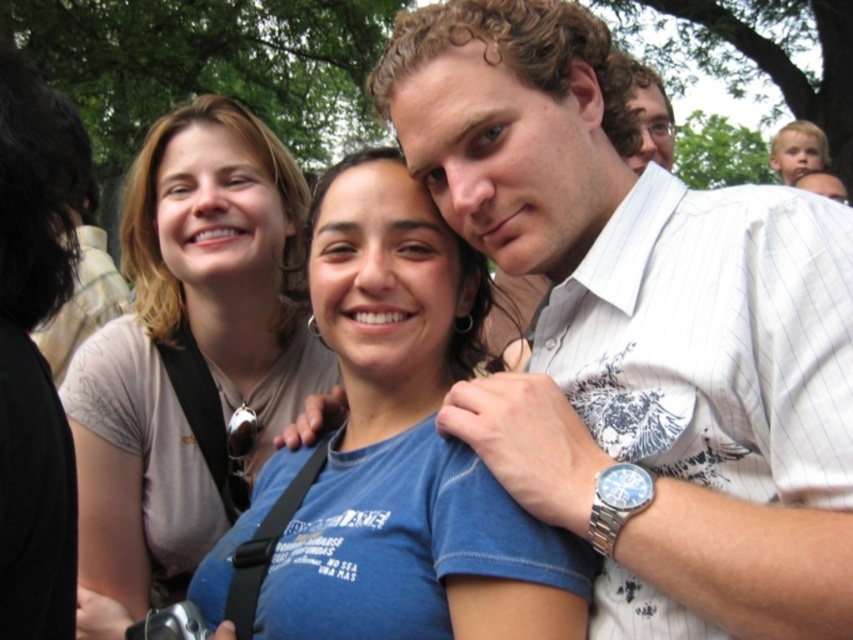
You are a photographer adjusting your camera settings to focus on the white pinstriped shirt at center and the matte black glasses at upper center. Which object should you focus on first to ensure both are in sharp focus?

The white pinstriped shirt at center should be focused on first because it is closer to the viewer than the matte black glasses at upper center. By focusing on the closer object, the farther one may still be in focus depending on the depth of field.

You are a photographer adjusting your camera settings. You notice the blue cotton shirt at center and the matte black glasses at upper center in your viewfinder. Which object should you focus on first if you want to capture both in sharp focus without moving the camera?

You should focus on the blue cotton shirt at center first because it has a greater height compared to the matte black glasses at upper center, making it more prominent in the frame.

You are standing in the park and want to locate the white pinstriped shirt at center. According to the coordinates provided, where should you look?

The white pinstriped shirt at center is located at point coordinates 0.514 on the x axis and 0.753 on the y axis.